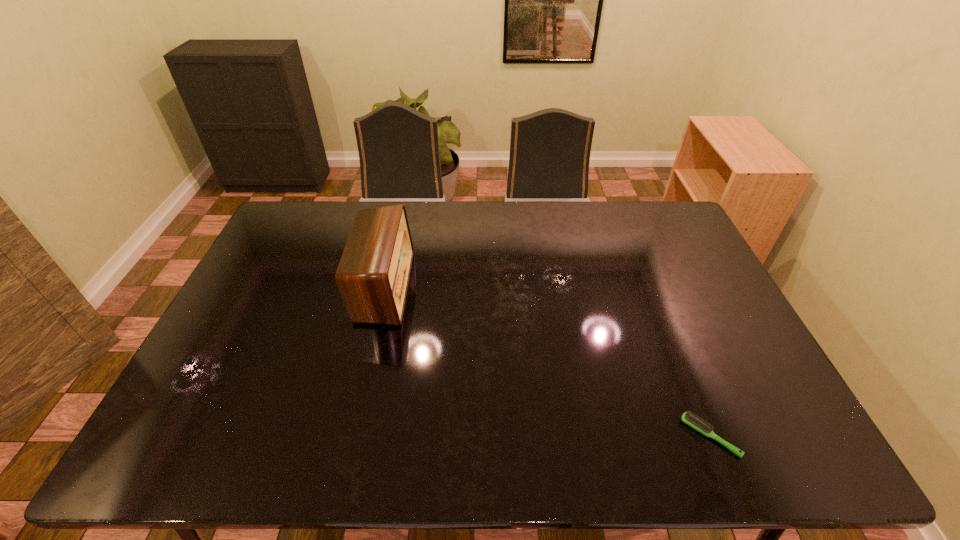
Locate an element on the screen. The width and height of the screenshot is (960, 540). vacant region at the near edge of the desktop is located at coordinates (264, 429).

Locate an element on the screen. The height and width of the screenshot is (540, 960). vacant space at the left edge of the desktop is located at coordinates (224, 407).

You are a GUI agent. You are given a task and a screenshot of the screen. Output one action in this format:
    pyautogui.click(x=<x>, y=<y>)
    Task: Click on the free location at the right edge
    
    Given the screenshot: What is the action you would take?
    pyautogui.click(x=698, y=299)

This screenshot has height=540, width=960. I want to click on vacant region at the far left corner of the desktop, so click(x=302, y=233).

In the image, there is a desktop. What are the coordinates of `vacant space at the near left corner` in the screenshot? It's located at (189, 460).

Identify the location of vacant area that satisfies the following two spatial constraints: 1. on the front-facing side of the radio receiver; 2. on the right side of the hairbrush. The width and height of the screenshot is (960, 540). (349, 436).

This screenshot has width=960, height=540. Find the location of `free space that satisfies the following two spatial constraints: 1. on the front-facing side of the hairbrush; 2. on the left side of the farther object`. free space that satisfies the following two spatial constraints: 1. on the front-facing side of the hairbrush; 2. on the left side of the farther object is located at coordinates (349, 436).

You are a GUI agent. You are given a task and a screenshot of the screen. Output one action in this format:
    pyautogui.click(x=<x>, y=<y>)
    Task: Click on the vacant region that satisfies the following two spatial constraints: 1. on the front-facing side of the right object; 2. on the right side of the taller object
    This screenshot has width=960, height=540.
    Given the screenshot: What is the action you would take?
    pyautogui.click(x=349, y=436)

Where is `vacant area that satisfies the following two spatial constraints: 1. on the front-facing side of the shorter object; 2. on the left side of the radio receiver`? vacant area that satisfies the following two spatial constraints: 1. on the front-facing side of the shorter object; 2. on the left side of the radio receiver is located at coordinates (349, 436).

Where is `vacant region that satisfies the following two spatial constraints: 1. on the front-facing side of the radio receiver; 2. on the back side of the right object`? The height and width of the screenshot is (540, 960). vacant region that satisfies the following two spatial constraints: 1. on the front-facing side of the radio receiver; 2. on the back side of the right object is located at coordinates (349, 436).